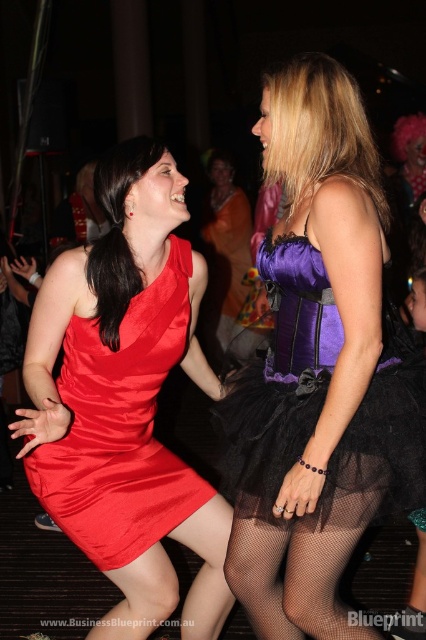
You are organizing a costume party and need to ensure that all outfits are appropriately sized. You have a storage box that can only accommodate items narrower than the satin dress at center. Will the black fishnet tights at lower center fit inside the box?

The black fishnet tights at lower center has a lesser width compared to the satin dress at center, so they will fit inside the storage box since they are narrower.

You are standing at the point labeled as point (267, 394) and want to greet someone across the room. If the average walking distance for a greeting is about 6 feet, can you reach the person you want to greet without moving more than 6 feet from your current position?

The distance between you and the viewer is 5.96 feet, which is just under 6 feet. Therefore, you can reach the person without moving more than 6 feet from your current position.

You are taking a photo of two women at a social event. You want to focus on the woman on the left wearing the red sleeveless dress. Which of the two points, point 1 at coordinates (321, 600) or point 2 at coordinates (212, 285), is closer to the camera and should be used for focusing?

Point 1 at coordinates (321, 600) is closer to the camera than point 2 at coordinates (212, 285), so you should focus on point 1 at coordinates (321, 600) to ensure the woman on the left is in focus.